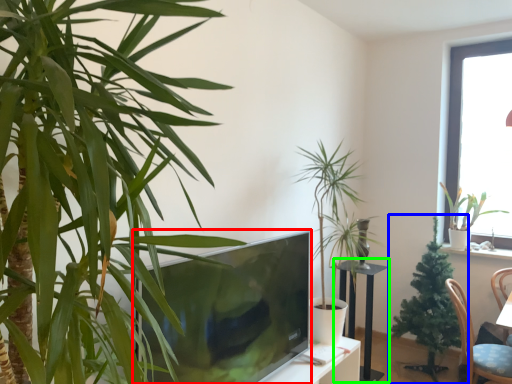
Question: Based on their relative distances, which object is farther from television (highlighted by a red box)? Choose from houseplant (highlighted by a blue box) and round table (highlighted by a green box).

Choices:
 (A) houseplant
 (B) round table

Answer: (A)